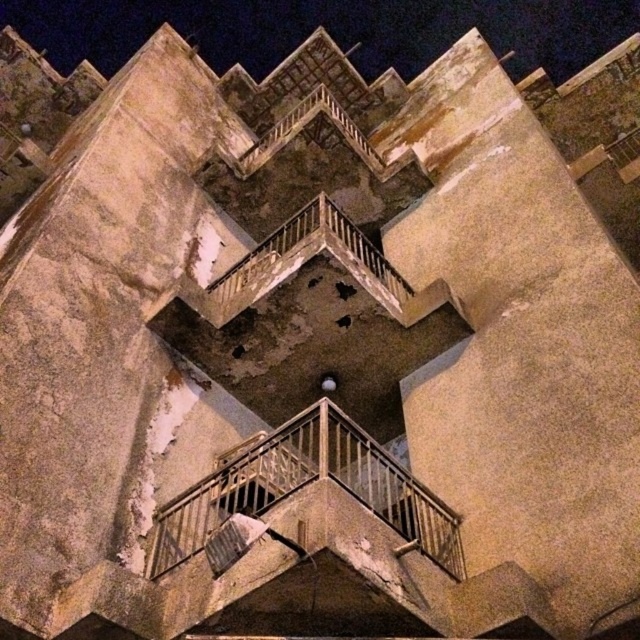
You are a drone operator trying to capture a closeup of the rusty metal balcony at center from an aerial view. The drone has a maximum flight distance of 80 feet. Can the drone safely reach the balcony without exceeding its range limit?

The rusty metal balcony at center is 78.21 feet from the camera, which is within the drone operator drone has a maximum flight distance of 80 feet. Yes, the drone can safely reach the balcony without exceeding its range limit.